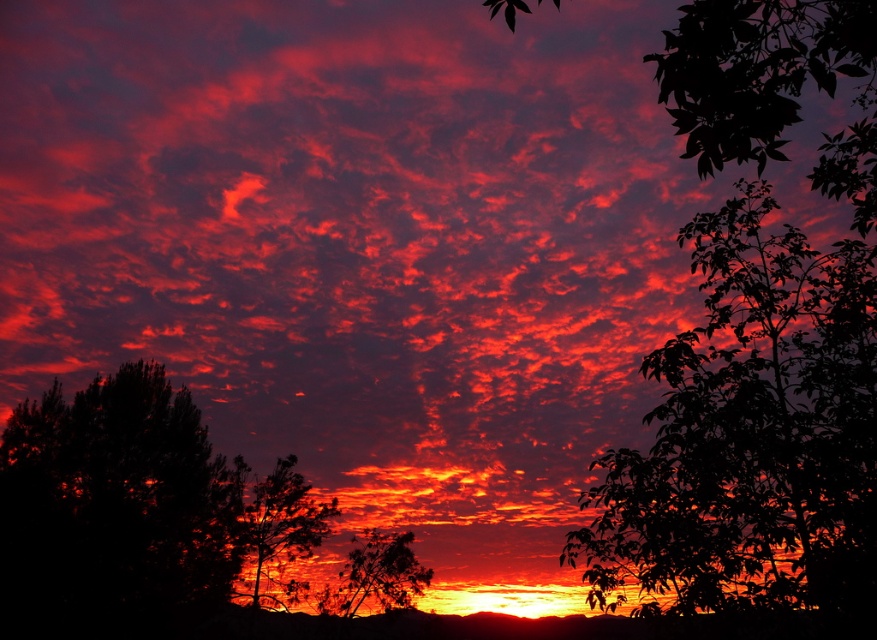
Question: Does silhouette tree at center appear under silky dark green tree at lower left?

Choices:
 (A) no
 (B) yes

Answer: (A)

Question: Does silhouette tree at center have a greater width compared to silky dark green tree at lower left?

Choices:
 (A) yes
 (B) no

Answer: (A)

Question: Is silhouette leafy tree at right positioned in front of silhouette leafy tree at center?

Choices:
 (A) yes
 (B) no

Answer: (A)

Question: Among these points, which one is farthest from the camera?

Choices:
 (A) (334, 596)
 (B) (269, 589)
 (C) (104, 493)

Answer: (C)

Question: Which point is farther to the camera?

Choices:
 (A) silhouette leafy tree at center
 (B) silky dark green tree at lower left
 (C) silhouette leafy tree at right
 (D) silhouette tree at center

Answer: (B)

Question: Which point is closer to the camera?

Choices:
 (A) (611, 480)
 (B) (376, 576)
 (C) (109, 586)
 (D) (291, 584)

Answer: (A)